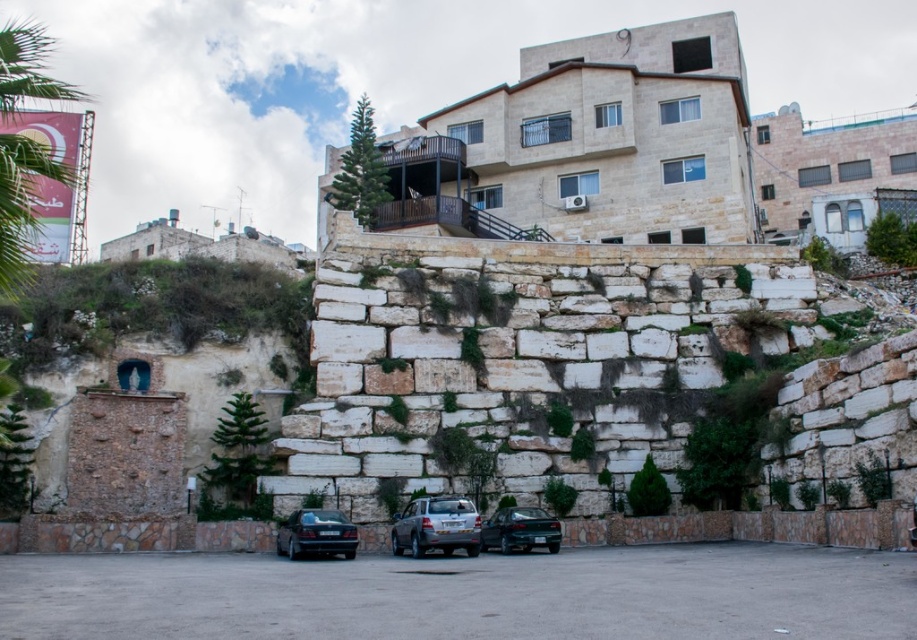
Question: Can you confirm if white stone wall at center is bigger than silver metallic car at center?

Choices:
 (A) yes
 (B) no

Answer: (A)

Question: Which object appears closest to the camera in this image?

Choices:
 (A) silver metallic car at center
 (B) white stone wall at center
 (C) teal glossy sedan at center

Answer: (B)

Question: Which point is farther from the camera taking this photo?

Choices:
 (A) (275, 540)
 (B) (451, 545)
 (C) (794, 273)
 (D) (523, 509)

Answer: (C)

Question: Which of the following is the closest to the observer?

Choices:
 (A) (311, 513)
 (B) (393, 528)
 (C) (329, 410)

Answer: (A)

Question: Where is silver metallic car at center located in relation to teal glossy sedan at center in the image?

Choices:
 (A) left
 (B) right

Answer: (A)

Question: Is silver metallic car at center wider than teal glossy sedan at center?

Choices:
 (A) no
 (B) yes

Answer: (B)